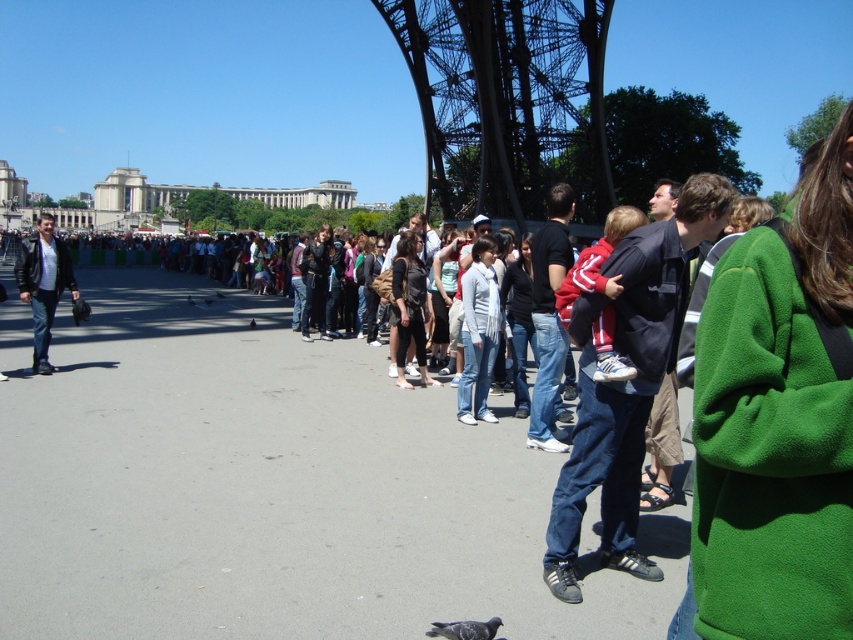
Does green fleece jacket at center appear on the right side of black leather jacket at left?

Indeed, green fleece jacket at center is positioned on the right side of black leather jacket at left.

At what (x,y) coordinates should I click in order to perform the action: click on green fleece jacket at center. Please return your answer as a coordinate pair (x, y). Looking at the image, I should click on (778, 419).

You are a GUI agent. You are given a task and a screenshot of the screen. Output one action in this format:
    pyautogui.click(x=<x>, y=<y>)
    Task: Click on the green fleece jacket at center
    This screenshot has width=853, height=640.
    Given the screenshot: What is the action you would take?
    pyautogui.click(x=778, y=419)

Is green fleece jacket at center positioned in front of metallic structure at center?

Yes, it is.

Between green fleece jacket at center and metallic structure at center, which one appears on the left side from the viewer's perspective?

metallic structure at center is more to the left.

Does point (740, 336) come in front of point (463, 22)?

Yes, it is.

This screenshot has width=853, height=640. Find the location of `green fleece jacket at center`. green fleece jacket at center is located at coordinates (778, 419).

Who is positioned more to the left, black leather jacket at left or gray matte pigeon at lower center?

Positioned to the left is black leather jacket at left.

Does black leather jacket at left have a larger size compared to gray matte pigeon at lower center?

Yes.

Between point (41, 275) and point (457, 636), which one is positioned behind?

The point (41, 275) is behind.

Identify the location of black leather jacket at left. Image resolution: width=853 pixels, height=640 pixels. (44, 284).